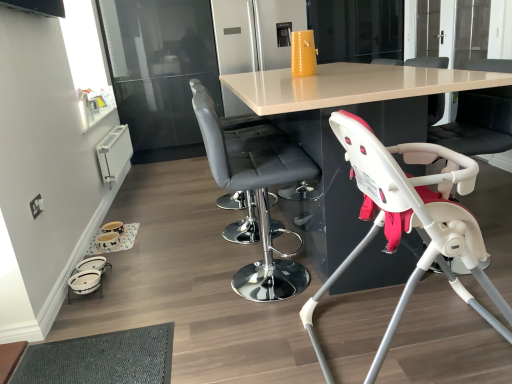
At what (x,y) coordinates should I click in order to perform the action: click on vacant space to the right of white plastic baby carriage at lower left. Please return your answer as a coordinate pair (x, y). The height and width of the screenshot is (384, 512). Looking at the image, I should click on (x=144, y=280).